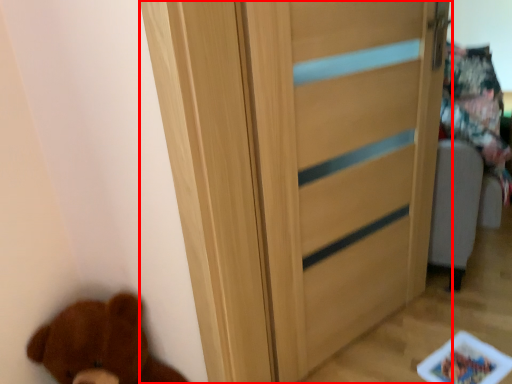
Question: In this image, where is door (annotated by the red box) located relative to brown bear?

Choices:
 (A) left
 (B) right

Answer: (B)